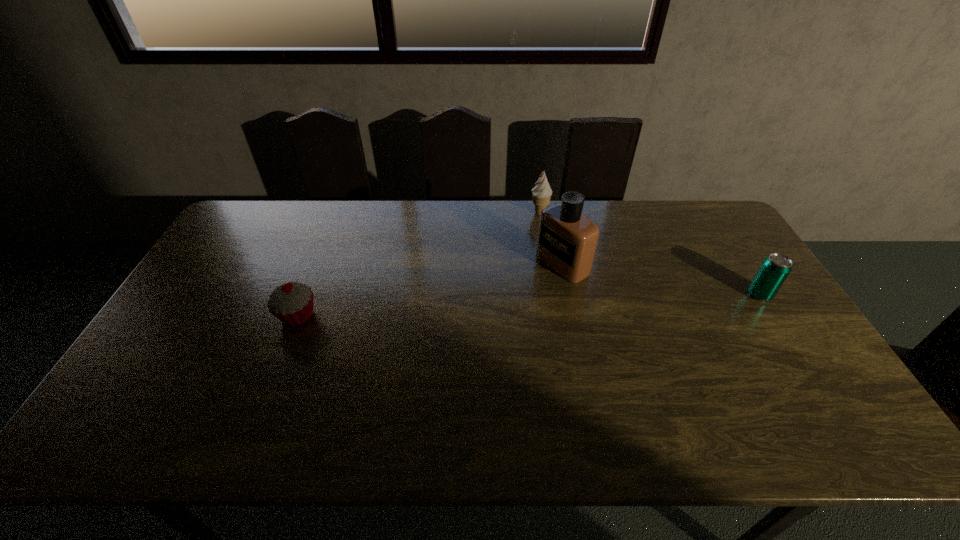
Where is `free space located on the front label of the perfume`? Image resolution: width=960 pixels, height=540 pixels. free space located on the front label of the perfume is located at coordinates (520, 290).

Where is `vacant space located 0.330m on the front-facing side of the icecream`? The image size is (960, 540). vacant space located 0.330m on the front-facing side of the icecream is located at coordinates (569, 282).

Locate an element on the screen. free space located 0.380m on the front-facing side of the icecream is located at coordinates (574, 294).

I want to click on vacant space located 0.200m on the front-facing side of the icecream, so click(x=558, y=254).

This screenshot has width=960, height=540. I want to click on object situated at the far edge, so click(x=542, y=192).

Identify the location of object present at the right edge. (775, 268).

Identify the location of vacant area at the far edge. The height and width of the screenshot is (540, 960). (668, 223).

The image size is (960, 540). I want to click on vacant space at the near edge of the desktop, so click(x=578, y=380).

In the image, there is a desktop. Where is `free space at the left edge`? This screenshot has height=540, width=960. free space at the left edge is located at coordinates (199, 325).

The height and width of the screenshot is (540, 960). I want to click on vacant space at the far left corner, so click(257, 207).